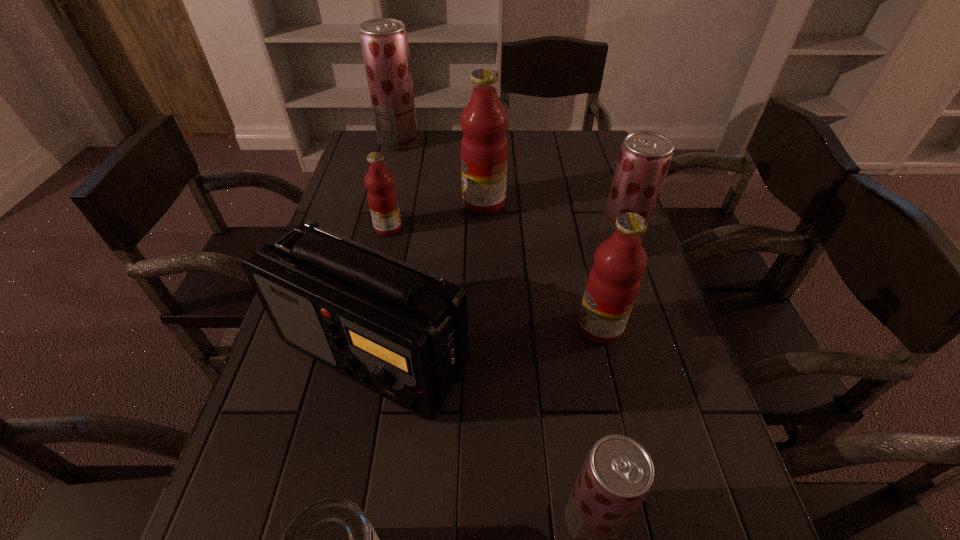
Identify the location of strawberry fruit juice that is the second closest one to the nearest fruit juice. The width and height of the screenshot is (960, 540). 384,42.

Locate an element on the screen. the second closest pink fruit juice to the nearest pink fruit juice is located at coordinates (382, 197).

Identify the location of the second closest pink fruit juice to the shortest object. This screenshot has width=960, height=540. (382, 197).

Where is `free spot that satisfies the following two spatial constraints: 1. on the label of the fourth fruit juice from right to left; 2. on the front panel of the radio receiver`? free spot that satisfies the following two spatial constraints: 1. on the label of the fourth fruit juice from right to left; 2. on the front panel of the radio receiver is located at coordinates (486, 355).

Identify the location of free region that satisfies the following two spatial constraints: 1. on the label of the nearest pink fruit juice; 2. on the front panel of the radio receiver. The image size is (960, 540). (607, 355).

Where is `free space that satisfies the following two spatial constraints: 1. on the label of the second smallest strawberry fruit juice; 2. on the right side of the second pink fruit juice from right to left`? The height and width of the screenshot is (540, 960). free space that satisfies the following two spatial constraints: 1. on the label of the second smallest strawberry fruit juice; 2. on the right side of the second pink fruit juice from right to left is located at coordinates (484, 245).